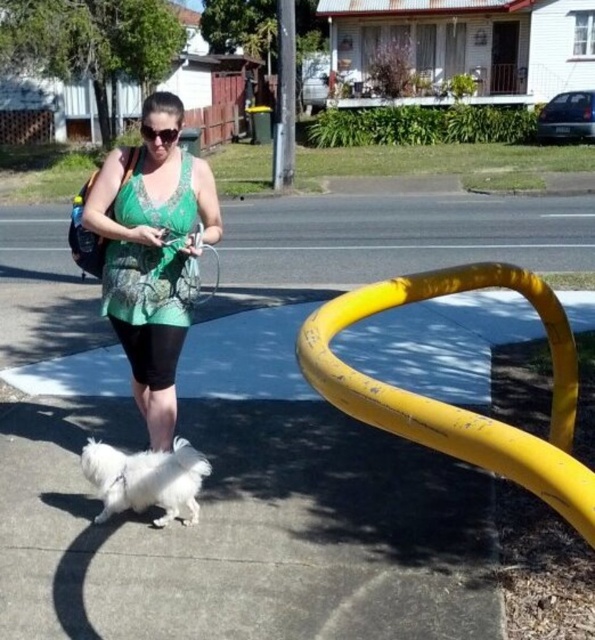
Who is taller, green lace dress at center or white fluffy dog at lower left?

With more height is green lace dress at center.

Can you confirm if green lace dress at center is positioned above white fluffy dog at lower left?

Yes, green lace dress at center is above white fluffy dog at lower left.

Who is more forward, (123, 184) or (170, 477)?

Point (170, 477) is more forward.

The width and height of the screenshot is (595, 640). What are the coordinates of `green lace dress at center` in the screenshot? It's located at (151, 262).

Who is more distant from viewer, (35, 461) or (148, 472)?

The point (35, 461) is behind.

Describe the element at coordinates (252, 436) in the screenshot. This screenshot has height=640, width=595. I see `yellow rubber pavement at center` at that location.

Where is `yellow rubber pavement at center`? yellow rubber pavement at center is located at coordinates (252, 436).

Which of these two, yellow rubber pavement at center or green lace dress at center, stands shorter?

green lace dress at center

Does yellow rubber pavement at center have a lesser height compared to green lace dress at center?

Incorrect, yellow rubber pavement at center's height does not fall short of green lace dress at center's.

You are a GUI agent. You are given a task and a screenshot of the screen. Output one action in this format:
    pyautogui.click(x=<x>, y=<y>)
    Task: Click on the yellow rubber pavement at center
    The height and width of the screenshot is (640, 595).
    Given the screenshot: What is the action you would take?
    pyautogui.click(x=252, y=436)

Where is `yellow rubber pavement at center`? Image resolution: width=595 pixels, height=640 pixels. yellow rubber pavement at center is located at coordinates (252, 436).